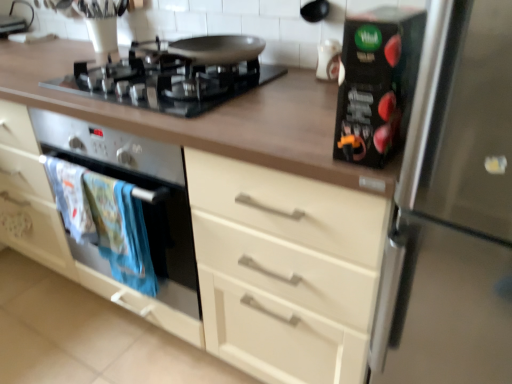
The height and width of the screenshot is (384, 512). Find the location of `free area in between black glass gas stove at upper center and black glossy box at upper right, which ranks as the 1th appliance in bottom-to-top order`. free area in between black glass gas stove at upper center and black glossy box at upper right, which ranks as the 1th appliance in bottom-to-top order is located at coordinates (278, 108).